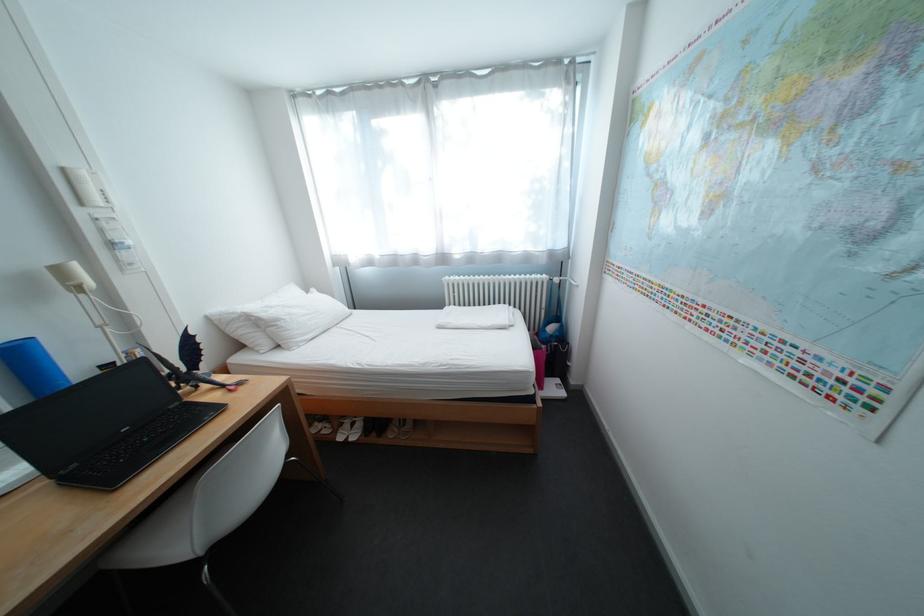
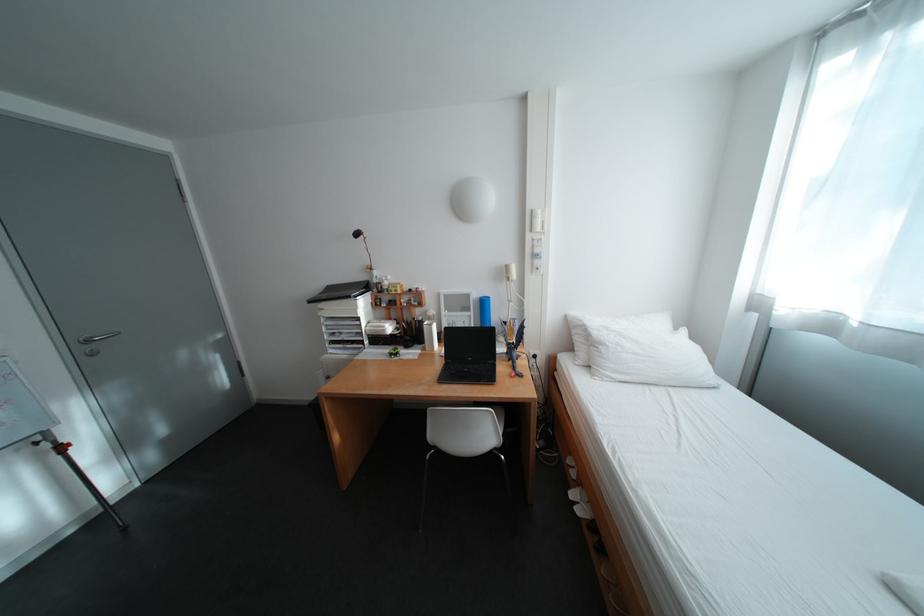
Find the pixel in the second image that matches [137,431] in the first image.

(481, 360)